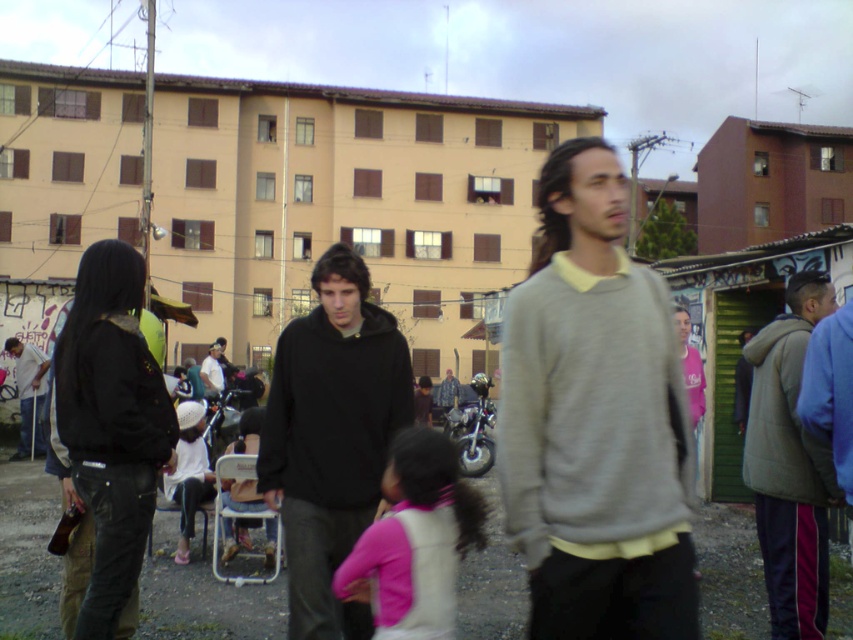
Question: Is gray sweater at center closer to camera compared to pink fleece jacket at center?

Choices:
 (A) yes
 (B) no

Answer: (A)

Question: Which point is farther to the camera?

Choices:
 (A) black matte hoodie at center
 (B) shiny metallic motorcycle at center

Answer: (A)

Question: Which point is farther from the camera taking this photo?

Choices:
 (A) tap(810, 637)
 (B) tap(625, 528)
 (C) tap(439, 392)
 (D) tap(486, 420)

Answer: (C)

Question: Can you confirm if black leather jacket at left is positioned above matte black crutch at left?

Choices:
 (A) no
 (B) yes

Answer: (B)

Question: Does gray sweater at center appear on the left side of black leather jacket at left?

Choices:
 (A) yes
 (B) no

Answer: (B)

Question: Which is farther from the black matte hoodie at center?

Choices:
 (A) gray woolen sweater at right
 (B) pink fleece jacket at center
 (C) dark gray hoodie at center
 (D) shiny metallic motorcycle at center

Answer: (C)